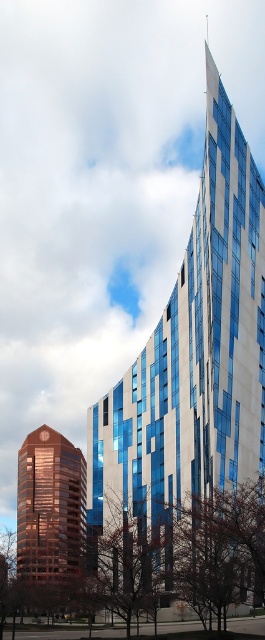
You are an architect evaluating the two buildings in the image. Which of the two buildings, the blue glass building at center or the shiny brown tower at lower left, is taller?

The blue glass building at center is taller than the shiny brown tower at lower left.

You are an architect evaluating the two buildings in the image. Which of the two buildings, the blue glass building at center or the shiny brown tower at lower left, has a larger overall size?

The blue glass building at center is bigger than the shiny brown tower at lower left, so the blue glass building at center has a larger overall size.